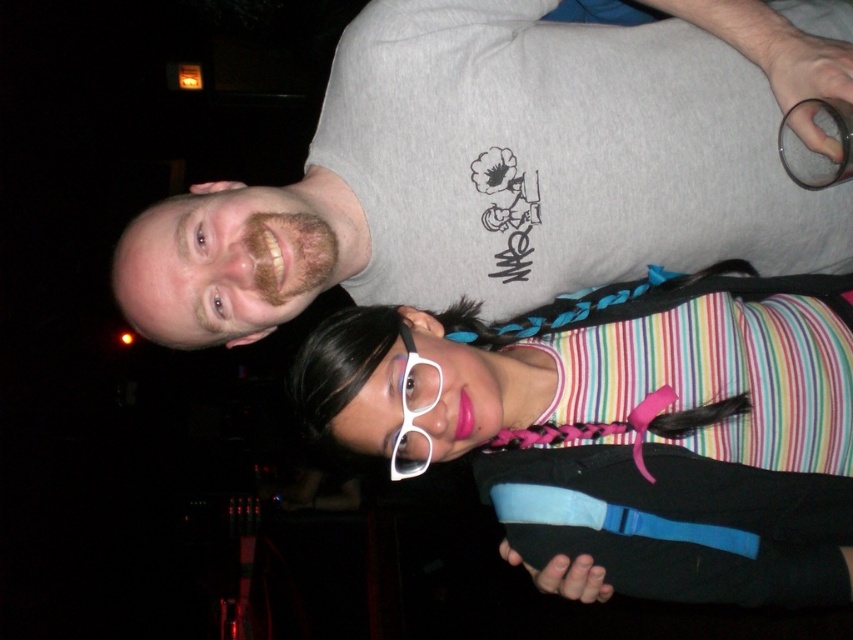
Question: Which point is farther from the camera taking this photo?

Choices:
 (A) (401, 330)
 (B) (398, 156)
 (C) (433, 323)

Answer: (B)

Question: Estimate the real-world distances between objects in this image. Which object is farther from the matte striped tank top at center?

Choices:
 (A) white plastic glasses at center
 (B) gray cotton t-shirt at upper center

Answer: (A)

Question: Does matte striped tank top at center lie behind white plastic glasses at center?

Choices:
 (A) yes
 (B) no

Answer: (A)

Question: Does gray cotton t-shirt at upper center have a larger size compared to white plastic glasses at center?

Choices:
 (A) yes
 (B) no

Answer: (A)

Question: Can you confirm if gray cotton t-shirt at upper center is positioned to the left of matte striped tank top at center?

Choices:
 (A) no
 (B) yes

Answer: (B)

Question: Estimate the real-world distances between objects in this image. Which object is closer to the matte striped tank top at center?

Choices:
 (A) gray cotton t-shirt at upper center
 (B) white plastic glasses at center

Answer: (A)